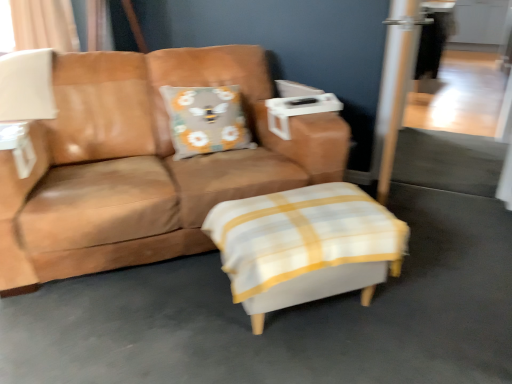
The height and width of the screenshot is (384, 512). I want to click on white fabric ottoman at center, so click(x=304, y=245).

This screenshot has width=512, height=384. I want to click on white matte table lamp at upper left, so click(x=24, y=102).

What is the approximate height of brown leather couch at center?

brown leather couch at center is 33.37 inches tall.

Locate an element on the screen. Image resolution: width=512 pixels, height=384 pixels. white fabric ottoman at center is located at coordinates (304, 245).

How different are the orientations of brown leather couch at center and gray fabric pillow with bee design at center in degrees?

The angular difference between brown leather couch at center and gray fabric pillow with bee design at center is 2.8 degrees.

From a real-world perspective, which is physically below, brown leather couch at center or gray fabric pillow with bee design at center?

brown leather couch at center is physically lower.

Considering the sizes of objects brown leather couch at center and gray fabric pillow with bee design at center in the image provided, who is bigger, brown leather couch at center or gray fabric pillow with bee design at center?

With larger size is brown leather couch at center.

From the image's perspective, which object appears higher, transparent glass screen door at upper right or gray fabric pillow with bee design at center?

transparent glass screen door at upper right is shown above in the image.

Between transparent glass screen door at upper right and gray fabric pillow with bee design at center, which one has larger size?

With larger size is transparent glass screen door at upper right.

Considering the points (378, 105) and (169, 105), which point is in front, point (378, 105) or point (169, 105)?

The point (169, 105) is more forward.

Which of these two, transparent glass screen door at upper right or gray fabric pillow with bee design at center, is thinner?

transparent glass screen door at upper right is thinner.

Where is `studio couch on the left side of transparent glass screen door at upper right`? This screenshot has width=512, height=384. studio couch on the left side of transparent glass screen door at upper right is located at coordinates (142, 164).

Is brown leather couch at center facing away from transparent glass screen door at upper right?

That's not correct — brown leather couch at center is not looking away from transparent glass screen door at upper right.

Considering the relative sizes of brown leather couch at center and transparent glass screen door at upper right in the image provided, is brown leather couch at center smaller than transparent glass screen door at upper right?

Incorrect, brown leather couch at center is not smaller in size than transparent glass screen door at upper right.

From the picture: Does brown leather couch at center have a greater width compared to transparent glass screen door at upper right?

Yes.

Are beige fabric curtain at upper left and white matte table lamp at upper left located far from each other?

No, beige fabric curtain at upper left is not far away from white matte table lamp at upper left.

Locate an element on the screen. The height and width of the screenshot is (384, 512). curtain located on the left of white matte table lamp at upper left is located at coordinates [44, 25].

Is white matte table lamp at upper left at the back of beige fabric curtain at upper left?

No.

Considering the sizes of objects beige fabric curtain at upper left and white matte table lamp at upper left in the image provided, who is shorter, beige fabric curtain at upper left or white matte table lamp at upper left?

Standing shorter between the two is white matte table lamp at upper left.

Is gray fabric pillow with bee design at center smaller than beige fabric curtain at upper left?

Correct, gray fabric pillow with bee design at center occupies less space than beige fabric curtain at upper left.

Could you tell me if gray fabric pillow with bee design at center is turned towards beige fabric curtain at upper left?

No, gray fabric pillow with bee design at center is not turned towards beige fabric curtain at upper left.

From a real-world perspective, is gray fabric pillow with bee design at center over beige fabric curtain at upper left?

Actually, gray fabric pillow with bee design at center is physically below beige fabric curtain at upper left in the real world.

Considering the relative positions of gray fabric pillow with bee design at center and beige fabric curtain at upper left in the image provided, is gray fabric pillow with bee design at center in front of beige fabric curtain at upper left?

That is True.

Can you confirm if beige fabric curtain at upper left is smaller than white fabric ottoman at center?

Actually, beige fabric curtain at upper left might be larger than white fabric ottoman at center.

Is beige fabric curtain at upper left further to camera compared to white fabric ottoman at center?

Yes, beige fabric curtain at upper left is further from the camera.

Consider the image. Are beige fabric curtain at upper left and white fabric ottoman at center far apart?

beige fabric curtain at upper left is far away from white fabric ottoman at center.

Identify the location of pillow in front of the beige fabric curtain at upper left. Image resolution: width=512 pixels, height=384 pixels. pyautogui.click(x=206, y=120).

Measure the distance from beige fabric curtain at upper left to gray fabric pillow with bee design at center.

beige fabric curtain at upper left is 1.18 meters from gray fabric pillow with bee design at center.

Is beige fabric curtain at upper left facing away from gray fabric pillow with bee design at center?

beige fabric curtain at upper left is not turned away from gray fabric pillow with bee design at center.

Is beige fabric curtain at upper left touching gray fabric pillow with bee design at center?

No, beige fabric curtain at upper left is not beside gray fabric pillow with bee design at center.

You are a GUI agent. You are given a task and a screenshot of the screen. Output one action in this format:
    pyautogui.click(x=<x>, y=<y>)
    Task: Click on the studio couch that is on the left side of gray fabric pillow with bee design at center
    
    Given the screenshot: What is the action you would take?
    pyautogui.click(x=142, y=164)

The image size is (512, 384). I want to click on pillow located in front of the transparent glass screen door at upper right, so click(x=206, y=120).

Based on their spatial positions, is white matte table lamp at upper left or brown leather couch at center closer to beige fabric curtain at upper left?

Among the two, white matte table lamp at upper left is located nearer to beige fabric curtain at upper left.

Considering their positions, is white matte table lamp at upper left positioned further to white fabric ottoman at center than gray fabric pillow with bee design at center?

white matte table lamp at upper left is positioned further to the anchor white fabric ottoman at center.

Which object lies nearer to the anchor point white fabric ottoman at center, brown leather couch at center or gray fabric pillow with bee design at center?

The object closer to white fabric ottoman at center is brown leather couch at center.

From the image, which object appears to be farther from brown leather couch at center, white matte table lamp at upper left or transparent glass screen door at upper right?

The object further to brown leather couch at center is transparent glass screen door at upper right.

Estimate the real-world distances between objects in this image. Which object is further from transparent glass screen door at upper right, gray fabric pillow with bee design at center or beige fabric curtain at upper left?

Based on the image, beige fabric curtain at upper left appears to be further to transparent glass screen door at upper right.

When comparing their distances from beige fabric curtain at upper left, does transparent glass screen door at upper right or white matte table lamp at upper left seem further?

transparent glass screen door at upper right.

Based on their spatial positions, is white fabric ottoman at center or gray fabric pillow with bee design at center further from brown leather couch at center?

white fabric ottoman at center is further to brown leather couch at center.

Considering their positions, is transparent glass screen door at upper right positioned closer to gray fabric pillow with bee design at center than brown leather couch at center?

brown leather couch at center is closer to gray fabric pillow with bee design at center.

This screenshot has width=512, height=384. I want to click on swivel chair between brown leather couch at center and transparent glass screen door at upper right, so click(x=304, y=245).

Find the location of a particular element. This screenshot has width=512, height=384. pillow between white matte table lamp at upper left and transparent glass screen door at upper right in the horizontal direction is located at coordinates (206, 120).

Locate an element on the screen. studio couch situated between white matte table lamp at upper left and gray fabric pillow with bee design at center from left to right is located at coordinates (142, 164).

This screenshot has width=512, height=384. Identify the location of pillow situated between brown leather couch at center and transparent glass screen door at upper right from left to right. (206, 120).